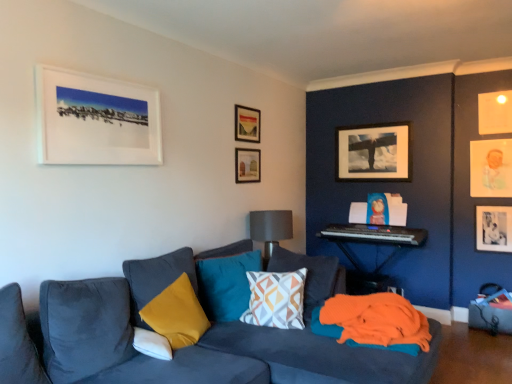
Question: In the image, is velvet yellow pillow at lower left, the second pillow from the front, positioned in front of or behind yellow fabric pillow at center, the 1th pillow when ordered from back to front?

Choices:
 (A) behind
 (B) front

Answer: (B)

Question: Is velvet yellow pillow at lower left, which is the 3th pillow in back-to-front order, spatially inside yellow fabric pillow at center, acting as the 4th pillow starting from the front, or outside of it?

Choices:
 (A) inside
 (B) outside

Answer: (B)

Question: Estimate the real-world distances between objects in this image. Which object is farther from the white matte picture frame at upper left, marked as the 7th picture frame in a back-to-front arrangement?

Choices:
 (A) black matte photo frame at right, the 2th picture frame when ordered from back to front
 (B) white soft pillow at lower left, the first pillow positioned from the front
 (C) gray fabric lampshade at center
 (D) pastel paper portrait at upper right, the 3th picture frame when ordered from right to left
 (E) geometric-patterned fabric pillow at center, the third pillow from the front

Answer: (A)

Question: Estimate the real-world distances between objects in this image. Which object is closer to the white soft pillow at lower left, the fourth pillow positioned from the back?

Choices:
 (A) black plastic keyboard at right
 (B) matte black picture frame at upper right, marked as the 4th picture frame in a right-to-left arrangement
 (C) yellow fabric pillow at center, acting as the 4th pillow starting from the front
 (D) matte wooden picture frame at upper center, the 2th picture frame viewed from the front
 (E) gray fabric lampshade at center

Answer: (C)